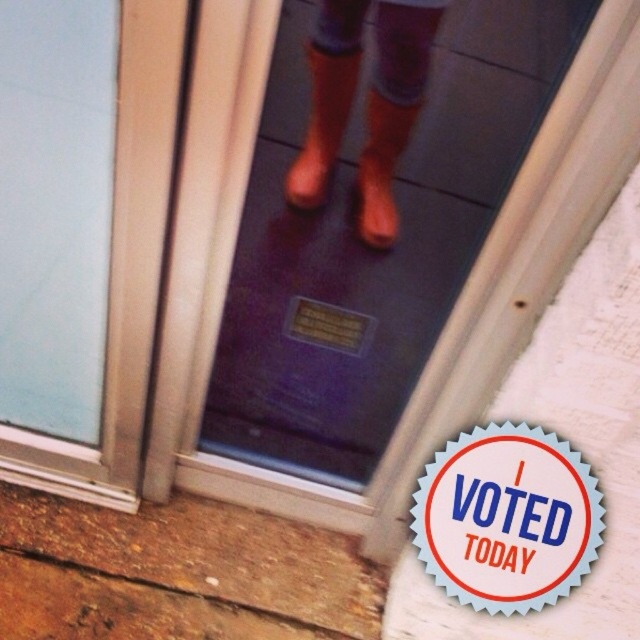
You are a delivery person who needs to place a package on the ground in front of the door without blocking the orange rubber boots at center or the orange rubber boot at center. Since you want to ensure there is enough space between the package and the boots, which object requires more space to its left side?

The orange rubber boots at center is wider than the orange rubber boot at center, so you should leave more space to the left side of the orange rubber boots at center.

You are standing in front of a door with a glass panel and orange rubber boots at center. The door has a metallic frame and a plaque near the bottom center. You want to place a small potted plant on the ground in front of the door. Where should you place it so it doesn

The orange rubber boots at center are located at point [392,108]. To place the potted plant away from the boots, position it near the plaque at the bottom center of the door.